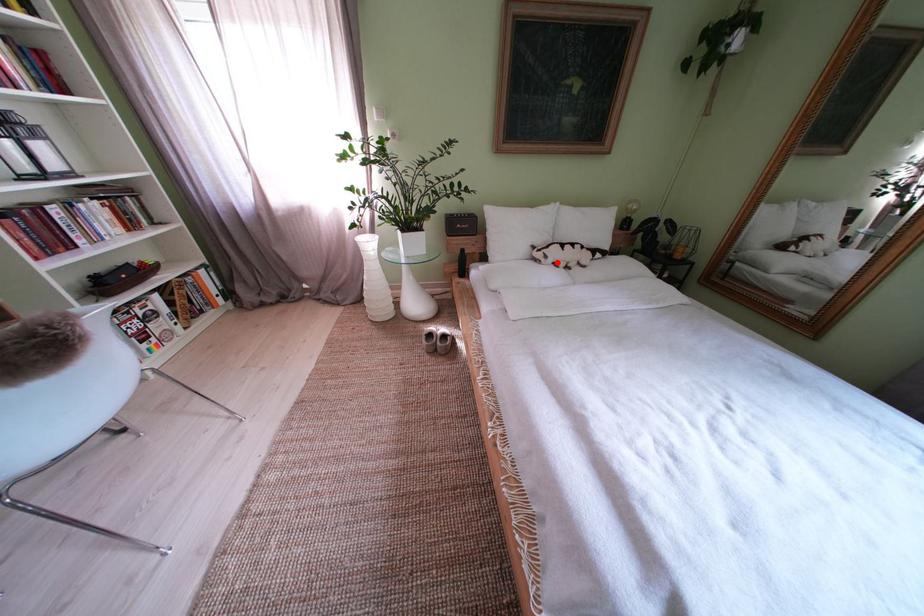
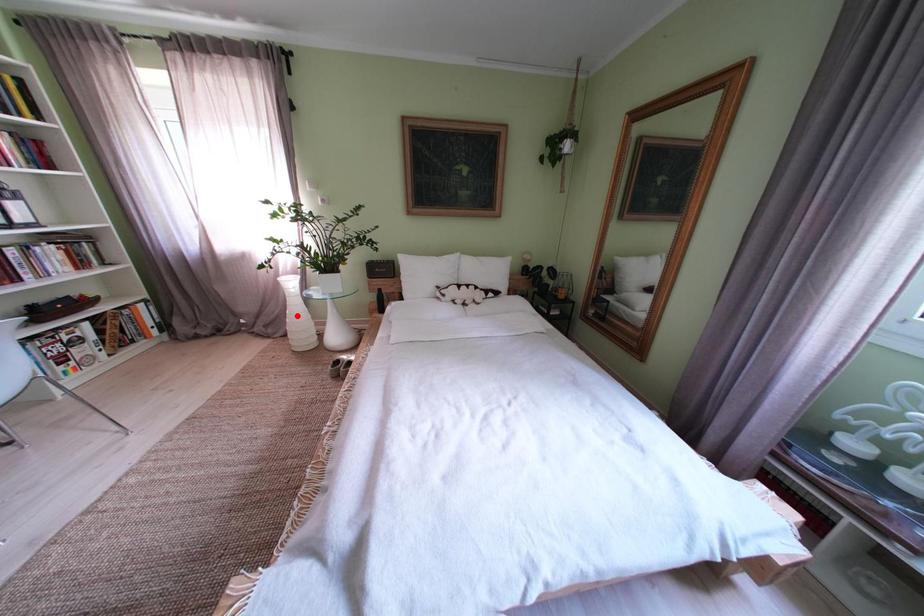
I am providing you with two images of the same scene from different viewpoints. A red point is marked on the first image and another point is marked on the second image. Does the point marked in image1 correspond to the same location as the one in image2?

No